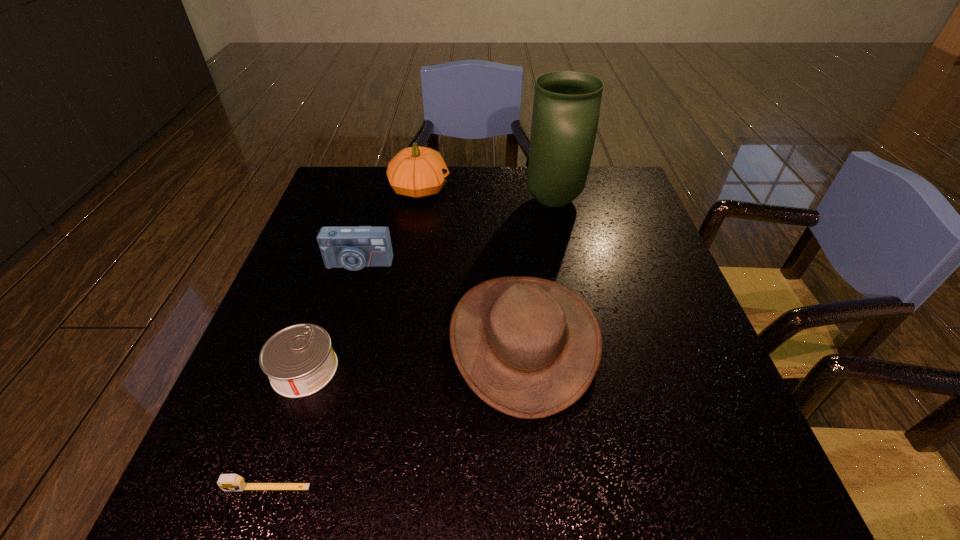
Identify the location of vase. Image resolution: width=960 pixels, height=540 pixels. (566, 108).

Where is `gourd`? This screenshot has width=960, height=540. gourd is located at coordinates (417, 172).

At what (x,y) coordinates should I click in order to perform the action: click on cowboy hat. Please return your answer as a coordinate pair (x, y). Looking at the image, I should click on (529, 347).

Identify the location of camera. This screenshot has height=540, width=960. (353, 248).

Locate an element on the screen. This screenshot has width=960, height=540. the second shortest object is located at coordinates (299, 360).

Image resolution: width=960 pixels, height=540 pixels. What are the coordinates of `tape measure` in the screenshot? It's located at (227, 482).

Where is `the shortest object`? Image resolution: width=960 pixels, height=540 pixels. the shortest object is located at coordinates (227, 482).

You are a GUI agent. You are given a task and a screenshot of the screen. Output one action in this format:
    pyautogui.click(x=<x>, y=<y>)
    Task: Click on the vacant area situated on the left of the tallest object
    This screenshot has height=540, width=960.
    Given the screenshot: What is the action you would take?
    pyautogui.click(x=417, y=200)

The image size is (960, 540). Identify the location of free region located on the side of the gourd with the carved face. (491, 189).

Locate an element on the screen. The height and width of the screenshot is (540, 960). vacant region located on the back of the cowboy hat is located at coordinates (511, 194).